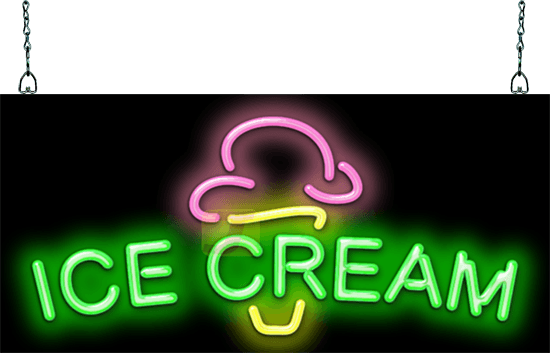
You are a GUI agent. You are given a task and a screenshot of the screen. Output one action in this format:
    pyautogui.click(x=<x>, y=<y>)
    Task: Click on the light glow
    The width and height of the screenshot is (550, 353).
    Given the screenshot: What is the action you would take?
    coord(185,259), coord(392,241), coord(295,338), coord(328,135)